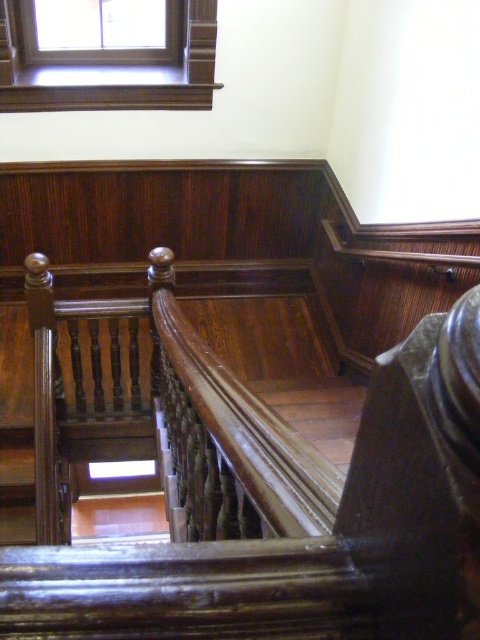
Looking at this image, you are standing at the bottom of the staircase and want to know how far you are from the point marked at coordinates point (x=100, y=106). Can you determine the distance?

The distance between you and the point (x=100, y=106) is 3.37 meters.

You are standing at the bottom of the staircase and want to reach the top. There are two points marked on the staircase, point 1 at coordinates point (x=116, y=636) and point 2 at coordinates point (x=214, y=17). Which point should you step on first to ascend the staircase?

You should step on point (x=116, y=636) first because it is in front of point (x=214, y=17).

You are a maintenance worker inspecting the staircase. You need to measure the distance between the glossy wood handrail at upper center and the nearest step. Can you determine if the handrail is within a safe distance of at least 12 inches from the step?

The glossy wood handrail at upper center is 15.86 inches from camera, so it is within the safe distance of at least 12 inches from the step.